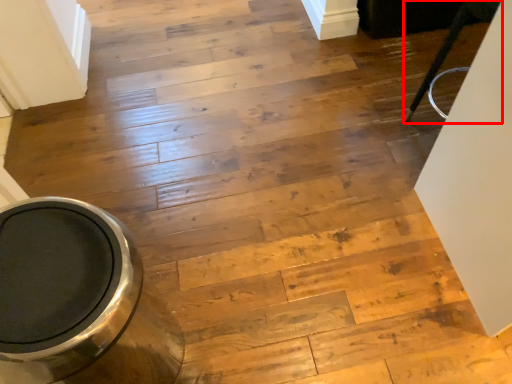
Question: Observing the image, what is the correct spatial positioning of furniture (annotated by the red box) in reference to toilet bowl?

Choices:
 (A) left
 (B) right

Answer: (B)